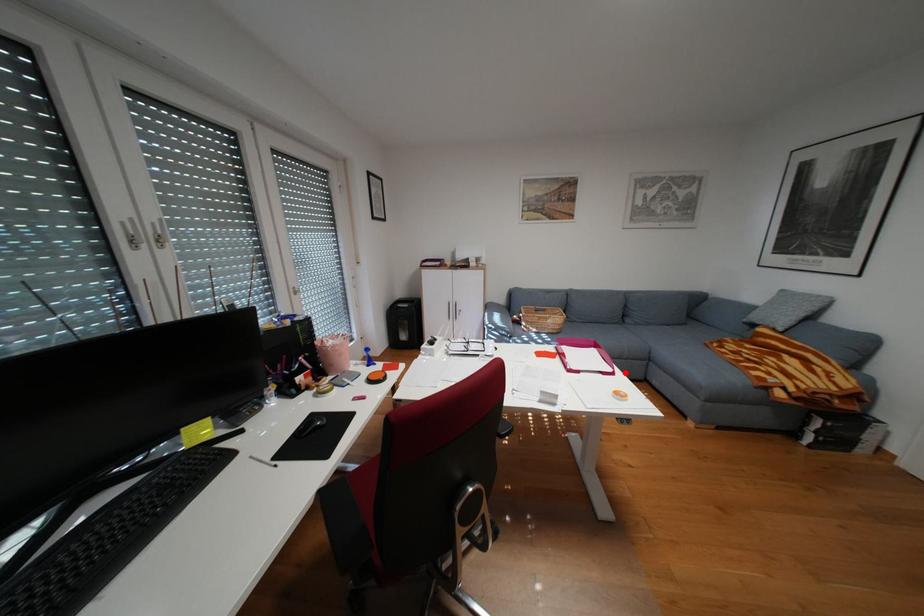
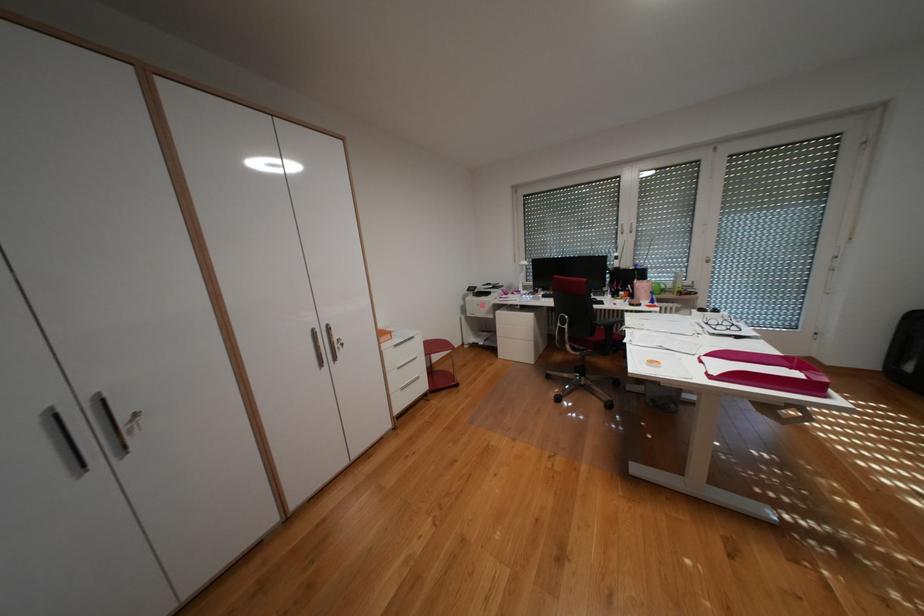
Where in the second image is the point corresponding to the highlighted location from the first image?

(723, 377)